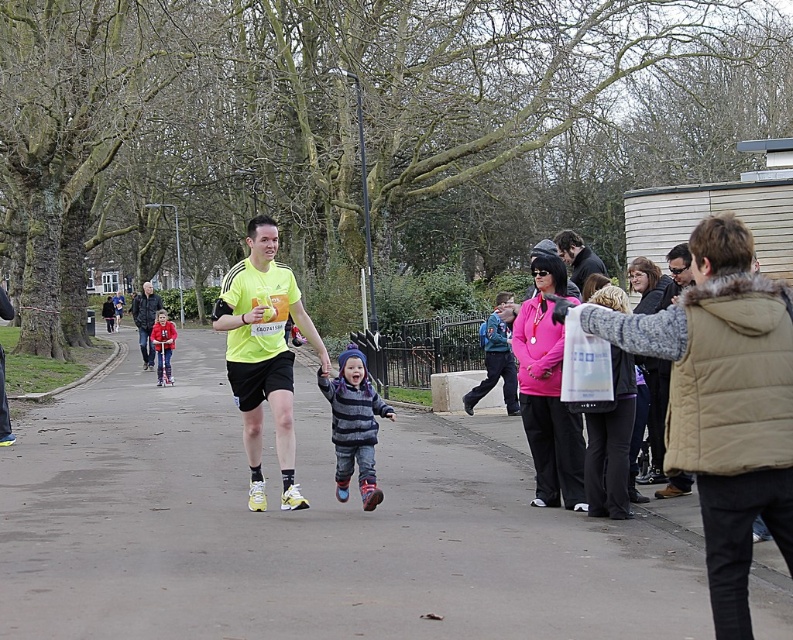
You are a photographer trying to capture a photo of the pink fleece jacket at center and the matte pink sweater at center. Which one is positioned lower in the image?

The pink fleece jacket at center is positioned lower than the matte pink sweater at center in the image.

You are a photographer at the park and want to take a photo of the pink fleece jacket at center and the red fleece jacket at center. The minimum distance required between the two subjects for your camera lens to focus properly is 40 feet. Can you capture both subjects in focus?

The pink fleece jacket at center and red fleece jacket at center are 43.94 feet apart, which exceeds the minimum 40 feet requirement. Yes, you can capture both subjects in focus.

You are a photographer at the event and want to capture both the pink fleece jacket at center and the red fleece jacket at center in a single photo. Which jacket should you focus on to ensure both are in frame without needing to adjust your camera angle?

The pink fleece jacket at center is much taller than the red fleece jacket at center, so focusing on the taller pink fleece jacket at center will ensure both are within the camera frame without needing adjustments.